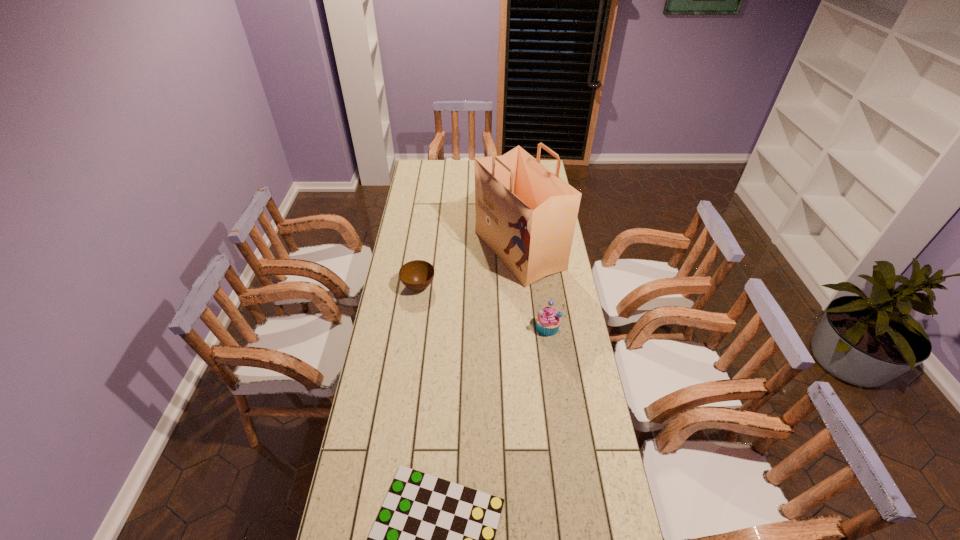
Find the location of `grocery bag`. grocery bag is located at coordinates (526, 214).

Find the location of a particular element. The image size is (960, 540). muffin is located at coordinates (548, 320).

The height and width of the screenshot is (540, 960). Find the location of `the second nearest object`. the second nearest object is located at coordinates (548, 320).

Find the location of `bowl`. bowl is located at coordinates (416, 275).

Locate an element on the screen. Image resolution: width=960 pixels, height=540 pixels. vacant space located on the side of the tallest object with the superhero design is located at coordinates (460, 250).

Image resolution: width=960 pixels, height=540 pixels. I want to click on vacant region located on the side of the tallest object with the superhero design, so click(453, 250).

You are a GUI agent. You are given a task and a screenshot of the screen. Output one action in this format:
    pyautogui.click(x=<x>, y=<y>)
    Task: Click on the vacant space located 0.210m on the side of the tallest object with the superhero design
    This screenshot has width=960, height=540.
    Given the screenshot: What is the action you would take?
    pyautogui.click(x=430, y=250)

This screenshot has height=540, width=960. Identify the location of vacant space located 0.080m on the back of the third shortest object. (543, 302).

Identify the location of vacant space situated 0.290m on the back of the bowl. (426, 233).

You are a GUI agent. You are given a task and a screenshot of the screen. Output one action in this format:
    pyautogui.click(x=<x>, y=<y>)
    Task: Click on the object present at the left edge
    
    Given the screenshot: What is the action you would take?
    pyautogui.click(x=416, y=275)